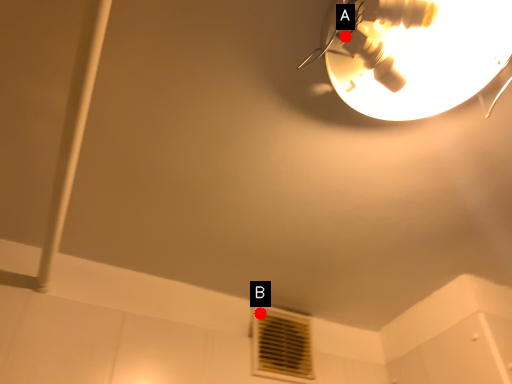
Question: Two points are circled on the image, labeled by A and B beside each circle. Which point is closer to the camera?

Choices:
 (A) A is closer
 (B) B is closer

Answer: (A)